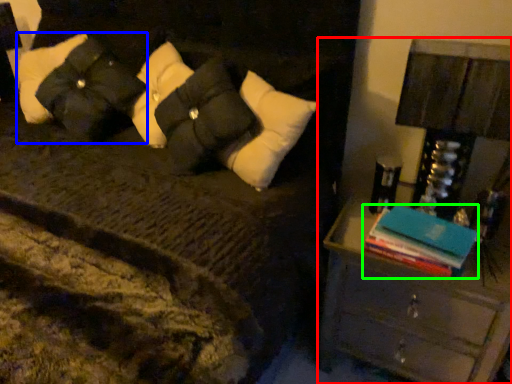
Question: Considering the real-world distances, which object is closest to nightstand (highlighted by a red box)? pillow (highlighted by a blue box) or book (highlighted by a green box).

Choices:
 (A) pillow
 (B) book

Answer: (B)